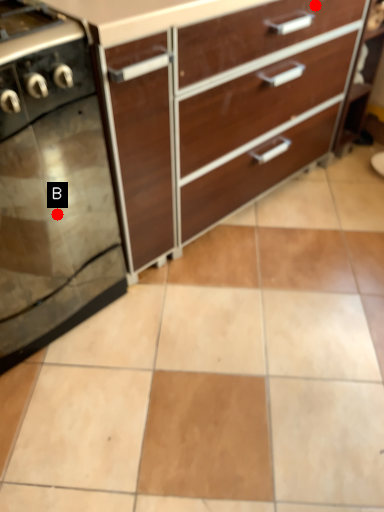
Question: Two points are circled on the image, labeled by A and B beside each circle. Which point is farther from the camera taking this photo?

Choices:
 (A) A is further
 (B) B is further

Answer: (A)